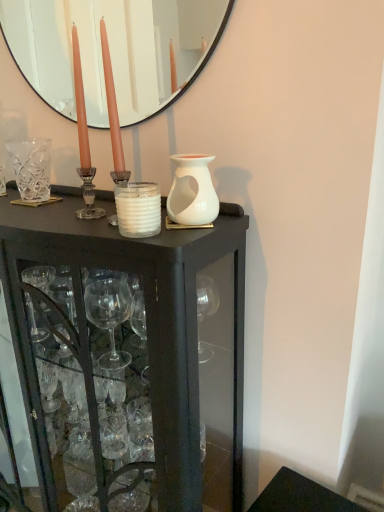
Question: From the image's perspective, is white matte vase at center positioned above or below white matte candle at center?

Choices:
 (A) below
 (B) above

Answer: (B)

Question: Considering their positions, is white matte vase at center located in front of or behind white matte candle at center?

Choices:
 (A) front
 (B) behind

Answer: (B)

Question: Which object is positioned farthest from the white matte vase at center?

Choices:
 (A) black glass cabinet at center
 (B) matte black mirror at upper center
 (C) white matte candle at center
 (D) clear crystal vase at left

Answer: (B)

Question: Considering the real-world distances, which object is farthest from the clear crystal vase at left?

Choices:
 (A) white matte candle at center
 (B) matte black mirror at upper center
 (C) white matte vase at center
 (D) black glass cabinet at center

Answer: (B)